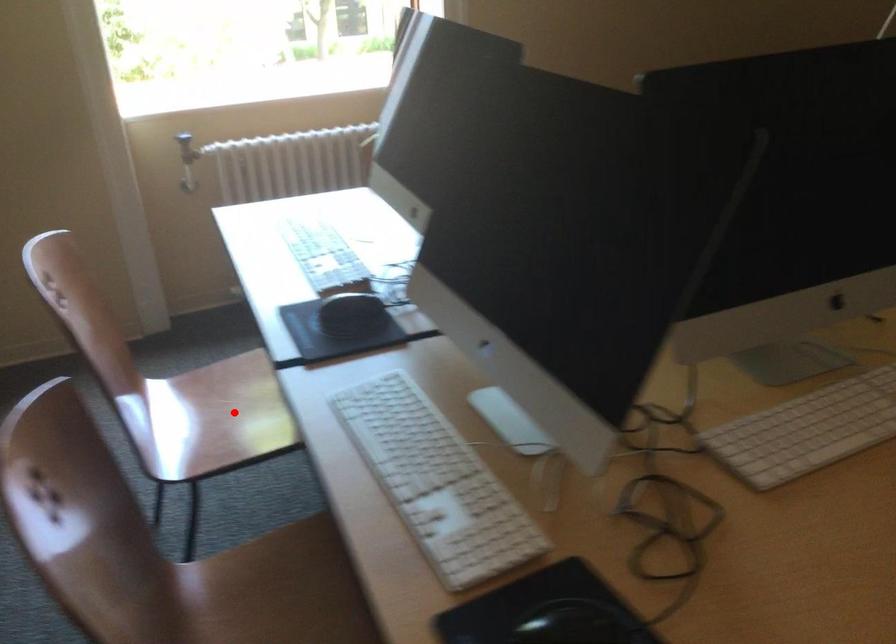
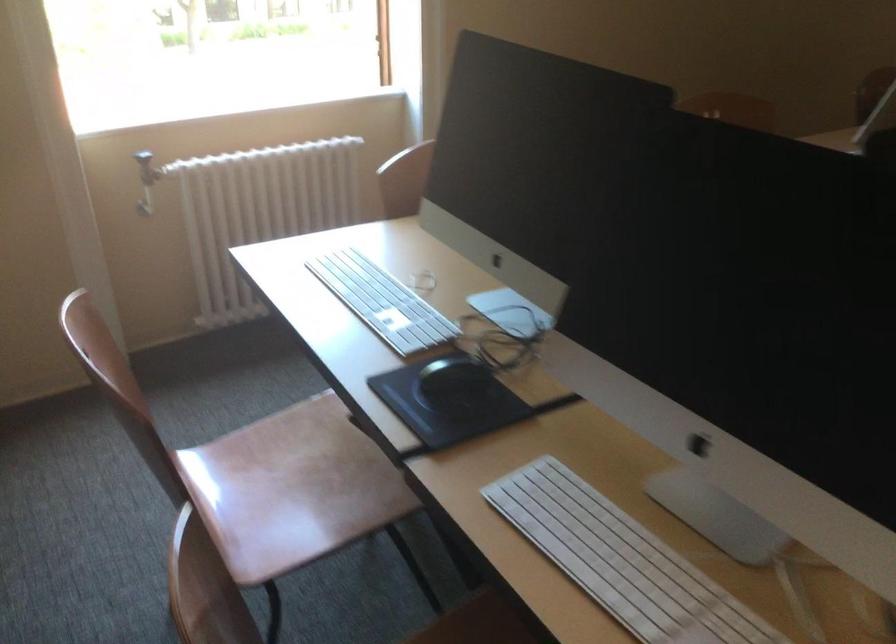
Locate, in the second image, the point that corresponds to the highlighted location in the first image.

(291, 488)